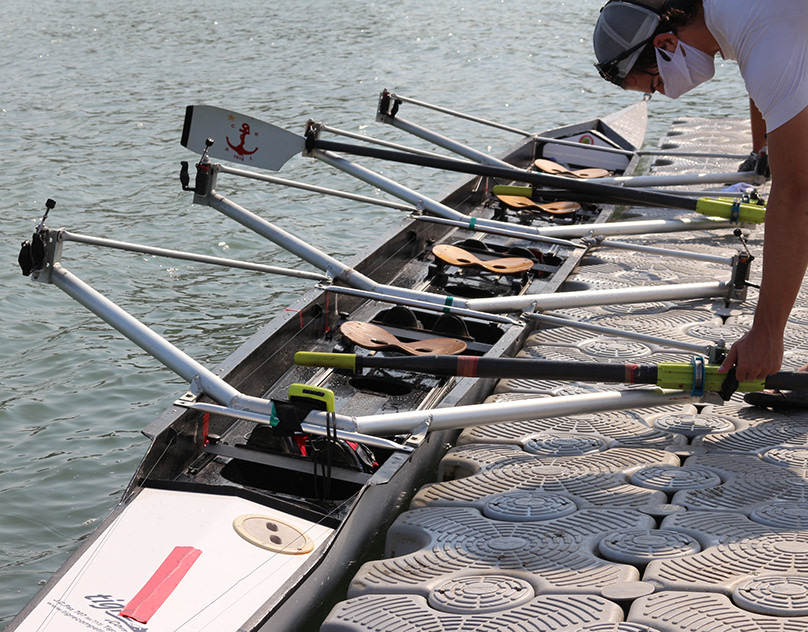
Image resolution: width=808 pixels, height=632 pixels. I want to click on seat, so click(x=481, y=267).